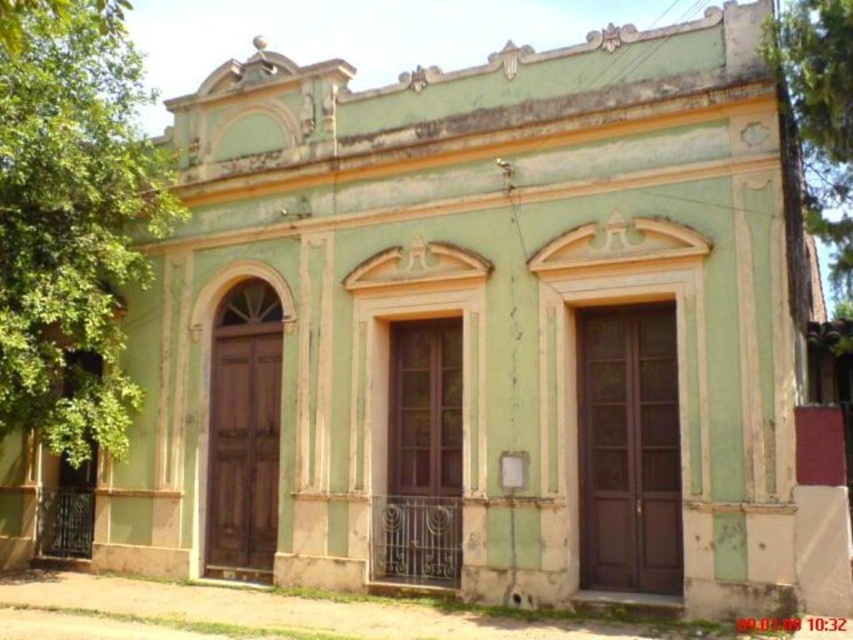
You are a painter standing in front of the two doors of the building. You want to paint the green leafy tree at left and the green textured tree at upper right. Which tree should you paint first if you want to paint the one closer to you?

The green leafy tree at left is in front of the green textured tree at upper right, so you should paint the green leafy tree at left first since it is closer to you.

You are a painter standing at the base of the green leafy tree at left and the green textured tree at upper right. You want to paint both trees but need to know which one is higher relative to the other. Which tree is positioned higher in the image?

The green leafy tree at left is located above the green textured tree at upper right, so it is positioned higher.